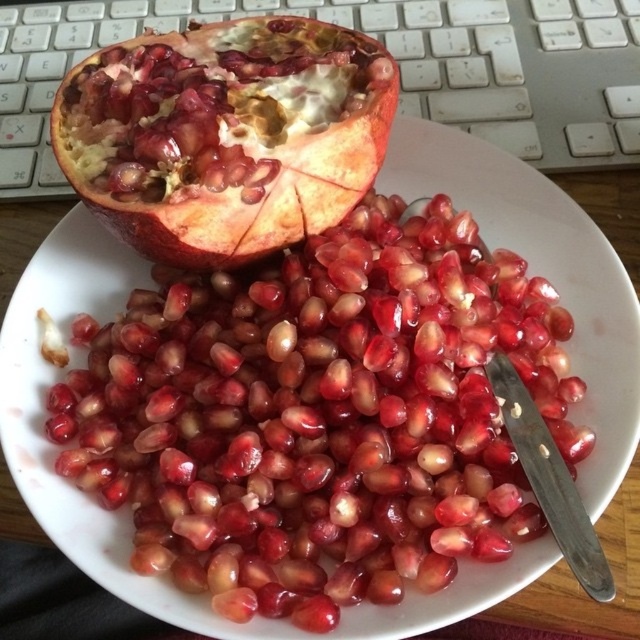
Question: Which point is farther to the camera?

Choices:
 (A) (364, 124)
 (B) (486, 316)
 (C) (627, 64)

Answer: (C)

Question: Which of the following is the closest to the observer?

Choices:
 (A) matte red pomegranate at upper left
 (B) shiny red pomegranate seeds at center

Answer: (B)

Question: Does matte red pomegranate at upper left have a larger size compared to white plastic keyboard at upper center?

Choices:
 (A) no
 (B) yes

Answer: (A)

Question: Can you confirm if shiny red pomegranate seeds at center is wider than matte red pomegranate at upper left?

Choices:
 (A) no
 (B) yes

Answer: (B)

Question: Which point is farther from the camera taking this photo?

Choices:
 (A) (253, 513)
 (B) (268, 189)

Answer: (B)

Question: Is shiny red pomegranate seeds at center closer to the viewer compared to matte red pomegranate at upper left?

Choices:
 (A) yes
 (B) no

Answer: (A)